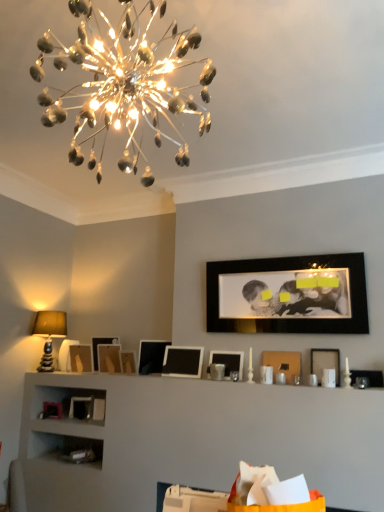
Question: Can you confirm if matte black picture frame at center, acting as the seventh picture frame starting from the right, is positioned to the left of matte black picture frame at center right, the 11th picture frame positioned from the left?

Choices:
 (A) yes
 (B) no

Answer: (A)

Question: From a real-world perspective, is matte black picture frame at center, positioned as the 6th picture frame in left-to-right order, on matte black picture frame at center right, positioned as the 2th picture frame in right-to-left order?

Choices:
 (A) no
 (B) yes

Answer: (B)

Question: Is matte black picture frame at center, acting as the seventh picture frame starting from the right, turned away from matte black picture frame at center right, positioned as the 2th picture frame in right-to-left order?

Choices:
 (A) no
 (B) yes

Answer: (A)

Question: Is matte black picture frame at center, positioned as the 6th picture frame in left-to-right order, positioned behind matte black picture frame at center right, positioned as the 2th picture frame in right-to-left order?

Choices:
 (A) no
 (B) yes

Answer: (B)

Question: Can you confirm if matte black picture frame at center, positioned as the 6th picture frame in left-to-right order, is thinner than matte black picture frame at center right, the 11th picture frame positioned from the left?

Choices:
 (A) no
 (B) yes

Answer: (A)

Question: From the image's perspective, would you say matte black picture frame at center, positioned as the 6th picture frame in left-to-right order, is shown under matte black picture frame at center right, positioned as the 2th picture frame in right-to-left order?

Choices:
 (A) yes
 (B) no

Answer: (A)

Question: Is the position of matte black picture frame at center, acting as the seventh picture frame starting from the right, less distant than that of black glossy picture frame at upper center, the tenth picture frame when ordered from left to right?

Choices:
 (A) yes
 (B) no

Answer: (B)

Question: Is matte black picture frame at center, acting as the seventh picture frame starting from the right, wider than black glossy picture frame at upper center, the tenth picture frame when ordered from left to right?

Choices:
 (A) no
 (B) yes

Answer: (B)

Question: Can we say matte black picture frame at center, positioned as the 6th picture frame in left-to-right order, lies outside black glossy picture frame at upper center, the third picture frame in the right-to-left sequence?

Choices:
 (A) no
 (B) yes

Answer: (B)

Question: Is matte black picture frame at center, positioned as the 6th picture frame in left-to-right order, shorter than black glossy picture frame at upper center, the tenth picture frame when ordered from left to right?

Choices:
 (A) yes
 (B) no

Answer: (A)

Question: Considering the relative positions of matte black picture frame at center, acting as the seventh picture frame starting from the right, and black glossy picture frame at upper center, the third picture frame in the right-to-left sequence, in the image provided, is matte black picture frame at center, acting as the seventh picture frame starting from the right, to the right of black glossy picture frame at upper center, the third picture frame in the right-to-left sequence, from the viewer's perspective?

Choices:
 (A) no
 (B) yes

Answer: (A)

Question: Considering the relative sizes of matte black picture frame at center, positioned as the 6th picture frame in left-to-right order, and black glossy picture frame at upper center, the third picture frame in the right-to-left sequence, in the image provided, is matte black picture frame at center, positioned as the 6th picture frame in left-to-right order, thinner than black glossy picture frame at upper center, the third picture frame in the right-to-left sequence,?

Choices:
 (A) yes
 (B) no

Answer: (B)

Question: Can you confirm if matte wooden picture frame at center, which is counted as the ninth picture frame, starting from the right, is shorter than matte black picture frame at right, which appears as the twelfth picture frame when viewed from the left?

Choices:
 (A) no
 (B) yes

Answer: (A)